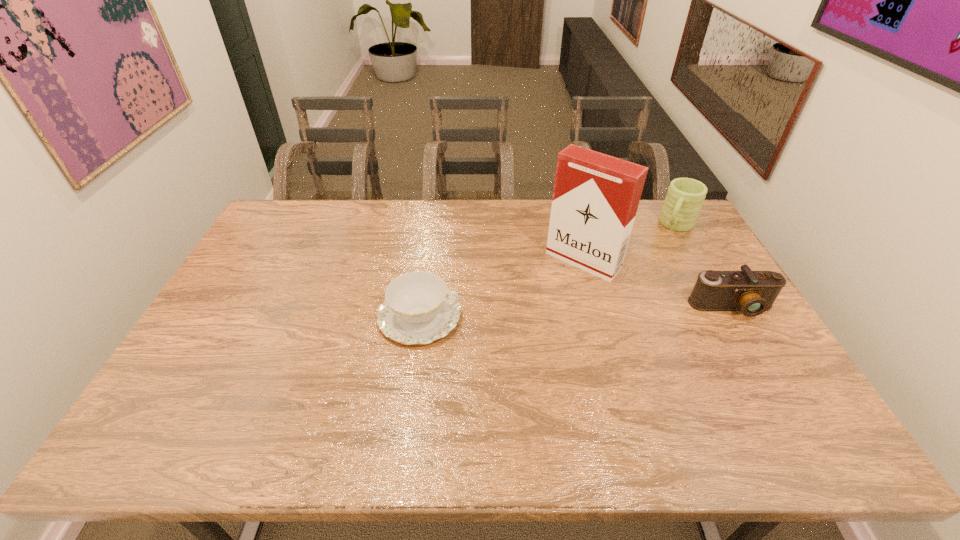
This screenshot has height=540, width=960. In order to click on vacant space in between the tallest object and the mug in this screenshot , I will do `click(630, 243)`.

Image resolution: width=960 pixels, height=540 pixels. I want to click on free spot between the chinaware and the third tallest object, so click(576, 312).

The image size is (960, 540). I want to click on free space between the cigarette_case and the leftmost object, so click(501, 288).

Locate an element on the screen. vacant space in between the third nearest object and the mug is located at coordinates (630, 243).

Select which object is the second closest to the chinaware. Please provide its 2D coordinates. Your answer should be formatted as a tuple, i.e. [(x, y)], where the tuple contains the x and y coordinates of a point satisfying the conditions above.

[(752, 292)]

Identify the location of object that is the third closest to the chinaware. (685, 196).